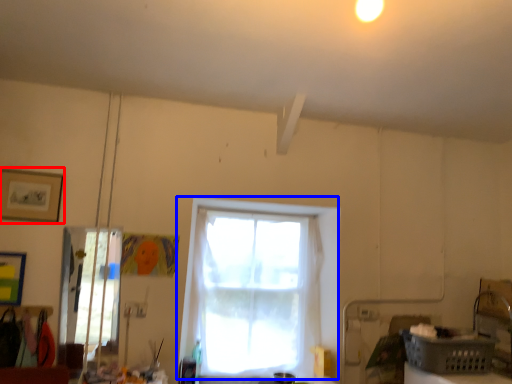
Question: Which object appears farthest to the camera in this image, picture frame (highlighted by a red box) or window (highlighted by a blue box)?

Choices:
 (A) picture frame
 (B) window

Answer: (B)